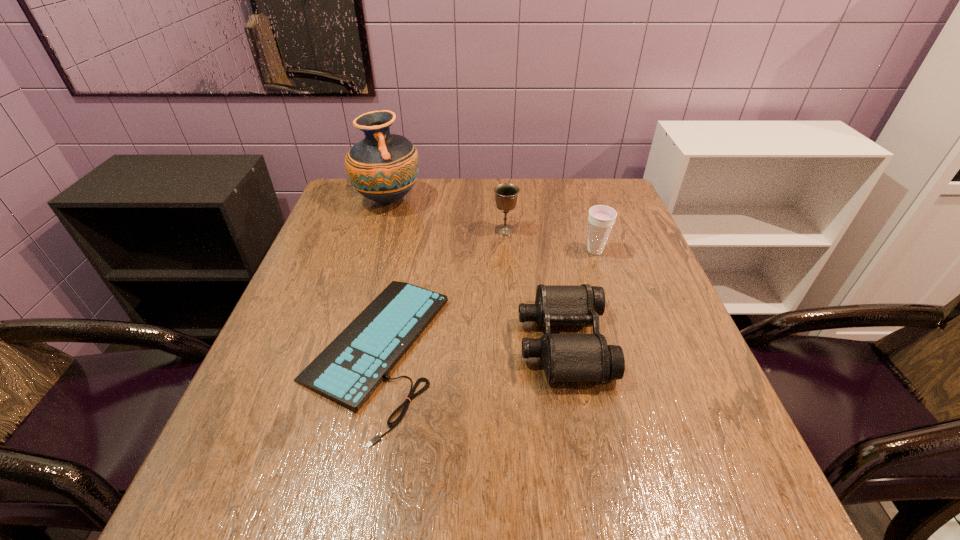
This screenshot has width=960, height=540. What are the coordinates of `unoccupied position between the tallest object and the computer keyboard` in the screenshot? It's located at (381, 275).

Find the location of `vacant space that's between the third farthest object and the second farthest object`. vacant space that's between the third farthest object and the second farthest object is located at coordinates (550, 240).

What are the coordinates of `free spot between the binoculars and the computer keyboard` in the screenshot? It's located at (469, 346).

The height and width of the screenshot is (540, 960). I want to click on free space between the computer keyboard and the chalice, so click(440, 290).

Find the location of a particular element. empty space between the shortest object and the binoculars is located at coordinates (469, 346).

Identify which object is the nearest to the computer keyboard. Please provide its 2D coordinates. Your answer should be formatted as a tuple, i.e. [(x, y)], where the tuple contains the x and y coordinates of a point satisfying the conditions above.

[(565, 357)]

Identify the location of object that is the nearest to the rightmost object. (565, 357).

The width and height of the screenshot is (960, 540). What are the coordinates of `vacant space that satisfies the following two spatial constraints: 1. on the front side of the cup; 2. on the left side of the fourth nearest object` in the screenshot? It's located at (507, 251).

The width and height of the screenshot is (960, 540). Identify the location of vacant position in the image that satisfies the following two spatial constraints: 1. on the front side of the cup; 2. through the eyepieces of the binoculars. (624, 341).

You are a GUI agent. You are given a task and a screenshot of the screen. Output one action in this format:
    pyautogui.click(x=<x>, y=<y>)
    Task: Click on the free spot that satisfies the following two spatial constraints: 1. on the front side of the shortest object; 2. on the left side of the pottery
    
    Given the screenshot: What is the action you would take?
    pyautogui.click(x=344, y=350)